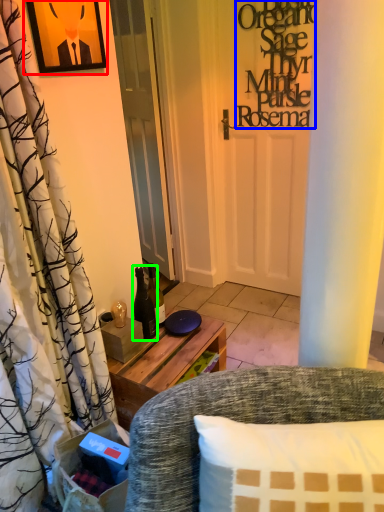
Question: Which object is the farthest from picture frame (highlighted by a red box)? Choose among these: writing (highlighted by a blue box) or bottle (highlighted by a green box).

Choices:
 (A) writing
 (B) bottle

Answer: (A)